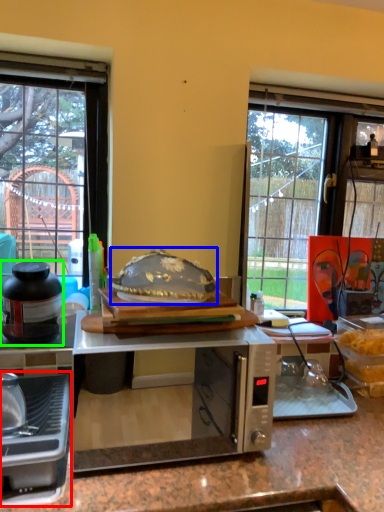
Question: Which object is positioned farthest from kitchen appliance (highlighted by a red box)? Select from food (highlighted by a blue box) and kitchen appliance (highlighted by a green box).

Choices:
 (A) food
 (B) kitchen appliance

Answer: (A)